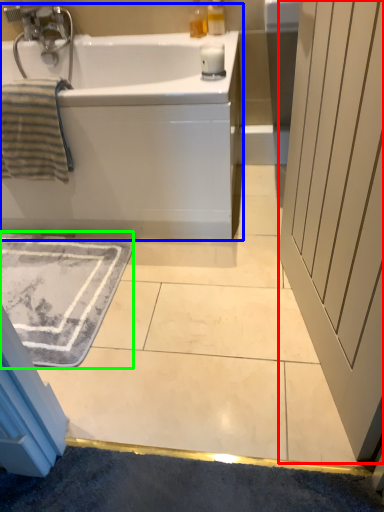
Question: Which object is positioned farthest from screen door (highlighted by a red box)? Select from bathtub (highlighted by a blue box) and bath mat (highlighted by a green box).

Choices:
 (A) bathtub
 (B) bath mat

Answer: (B)